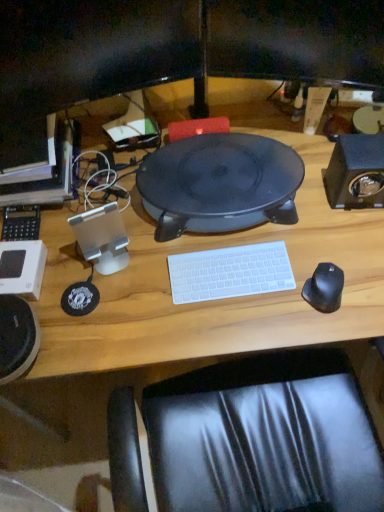
From the picture: Measure the distance between point (379, 167) and camera.

The depth of point (379, 167) is 3.54 feet.

You are a GUI agent. You are given a task and a screenshot of the screen. Output one action in this format:
    pyautogui.click(x=<x>, y=<y>)
    Task: Click on the black matte speaker at right
    
    Given the screenshot: What is the action you would take?
    pyautogui.click(x=356, y=172)

This screenshot has height=512, width=384. Describe the element at coordinates (230, 272) in the screenshot. I see `white plastic keyboard at center` at that location.

What do you see at coordinates (219, 184) in the screenshot?
I see `black matte speaker at center` at bounding box center [219, 184].

The height and width of the screenshot is (512, 384). What are the coordinates of `black matte mouse at right` in the screenshot? It's located at (324, 288).

Describe the element at coordinates (217, 300) in the screenshot. This screenshot has width=384, height=512. I see `wooden desk at center` at that location.

Locate an element on the screen. The width and height of the screenshot is (384, 512). black matte speaker at right is located at coordinates (356, 172).

Which is further, (x=371, y=292) or (x=268, y=283)?

Point (x=268, y=283)

Based on the photo, can you tell me how much wooden desk at center and white plastic keyboard at center differ in facing direction?

The angular difference between wooden desk at center and white plastic keyboard at center is 0.61 degrees.

Is wooden desk at center inside the boundaries of white plastic keyboard at center, or outside?

wooden desk at center cannot be found inside white plastic keyboard at center.

From a real-world perspective, does wooden desk at center sit lower than white plastic keyboard at center?

Yes, from a real-world perspective, wooden desk at center is under white plastic keyboard at center.

From the picture: Looking at their sizes, would you say black matte speaker at right is wider or thinner than wooden desk at center?

In the image, black matte speaker at right appears to be more narrow than wooden desk at center.

Are black matte speaker at right and wooden desk at center far apart?

No, black matte speaker at right is not far from wooden desk at center.

What's the angular difference between black matte speaker at right and wooden desk at center's facing directions?

7.52 degrees separate the facing orientations of black matte speaker at right and wooden desk at center.

In order to click on speaker that appears above the wooden desk at center (from the image's perspective) in this screenshot , I will do `click(356, 172)`.

Is white plastic keyboard at center at the back of black matte mouse at right?

No.

Based on the photo, which object is wider, black matte mouse at right or white plastic keyboard at center?

With larger width is white plastic keyboard at center.

Would you say black matte mouse at right is outside white plastic keyboard at center?

Indeed, black matte mouse at right is completely outside white plastic keyboard at center.

Considering their positions, is black matte mouse at right located in front of or behind white plastic keyboard at center?

Visually, black matte mouse at right is located in front of white plastic keyboard at center.

Is black matte speaker at center aimed at black matte mouse at right?

Yes, black matte speaker at center is oriented towards black matte mouse at right.

Is point (232, 135) closer to camera compared to point (305, 281)?

No, it is not.

From the image's perspective, which one is positioned lower, black matte speaker at center or black matte mouse at right?

black matte mouse at right is shown below in the image.

Locate an element on the screen. sit above the black matte mouse at right (from a real-world perspective) is located at coordinates (219, 184).

Relative to black matte speaker at right, is wooden desk at center in front or behind?

wooden desk at center is in front of black matte speaker at right.

Does wooden desk at center touch black matte speaker at right?

No, wooden desk at center is not beside black matte speaker at right.

From the image's perspective, which one is positioned lower, wooden desk at center or black matte speaker at right?

wooden desk at center appears lower in the image.

From a real-world perspective, which object stands above the other?

black matte speaker at right is physically above.

Is white plastic keyboard at center to the left of black matte speaker at right from the viewer's perspective?

Yes, white plastic keyboard at center is to the left of black matte speaker at right.

Between white plastic keyboard at center and black matte speaker at right, which one is positioned behind?

black matte speaker at right.

Between white plastic keyboard at center and black matte speaker at right, which one has larger size?

black matte speaker at right.

Is white plastic keyboard at center not within black matte speaker at right?

Yes, white plastic keyboard at center is not within black matte speaker at right.

Is black matte mouse at right not near wooden desk at center?

No.

Considering the sizes of black matte mouse at right and wooden desk at center in the image, is black matte mouse at right wider or thinner than wooden desk at center?

Considering their sizes, black matte mouse at right looks slimmer than wooden desk at center.

Who is shorter, black matte mouse at right or wooden desk at center?

black matte mouse at right is shorter.

Consider the image. Is the depth of black matte mouse at right less than that of wooden desk at center?

No, it is not.

I want to click on computer keyboard above the wooden desk at center (from a real-world perspective), so click(x=230, y=272).

You are a GUI agent. You are given a task and a screenshot of the screen. Output one action in this format:
    pyautogui.click(x=<x>, y=<y>)
    Task: Click on the desk to the left of black matte speaker at right
    
    Given the screenshot: What is the action you would take?
    pyautogui.click(x=217, y=300)

From the image, which object appears to be nearer to black matte mouse at right, black matte speaker at center or matte black monitor at left?

Based on the image, black matte speaker at center appears to be nearer to black matte mouse at right.

Estimate the real-world distances between objects in this image. Which object is further from black matte mouse at right, black matte speaker at center or white plastic keyboard at center?

black matte speaker at center.

In the scene shown: When comparing their distances from matte black monitor at left, does black matte mouse at right or black matte speaker at right seem further?

black matte speaker at right.

Considering their positions, is black matte mouse at right positioned closer to white plastic keyboard at center than black matte speaker at center?

The object closer to white plastic keyboard at center is black matte mouse at right.

Which object lies nearer to the anchor point matte black monitor at left, black matte speaker at center or black matte mouse at right?

black matte speaker at center is closer to matte black monitor at left.

Which object lies nearer to the anchor point black matte speaker at right, white plastic keyboard at center or matte black monitor at left?

white plastic keyboard at center is positioned closer to the anchor black matte speaker at right.

When comparing their distances from black matte speaker at right, does matte black monitor at left or black matte speaker at center seem closer?

Among the two, black matte speaker at center is located nearer to black matte speaker at right.

When comparing their distances from white plastic keyboard at center, does black matte speaker at right or wooden desk at center seem closer?

Among the two, wooden desk at center is located nearer to white plastic keyboard at center.

Locate an element on the screen. computer keyboard located between matte black monitor at left and black matte mouse at right in the left-right direction is located at coordinates (230, 272).

You are a GUI agent. You are given a task and a screenshot of the screen. Output one action in this format:
    pyautogui.click(x=<x>, y=<y>)
    Task: Click on the computer keyboard between black matte speaker at center and black matte speaker at right
    The width and height of the screenshot is (384, 512).
    Given the screenshot: What is the action you would take?
    pyautogui.click(x=230, y=272)

Where is `computer keyboard between black matte speaker at center and black matte mouse at right in the vertical direction`? computer keyboard between black matte speaker at center and black matte mouse at right in the vertical direction is located at coordinates (230, 272).

You are a GUI agent. You are given a task and a screenshot of the screen. Output one action in this format:
    pyautogui.click(x=<x>, y=<y>)
    Task: Click on the mouse between matte black monitor at left and black matte speaker at right in the horizontal direction
    The height and width of the screenshot is (512, 384).
    Given the screenshot: What is the action you would take?
    pyautogui.click(x=324, y=288)